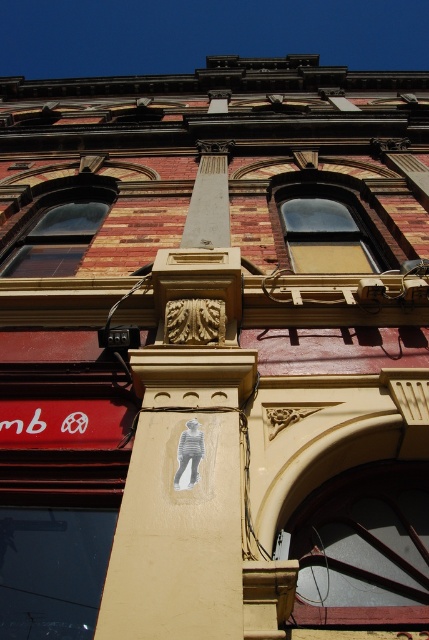
Question: Does clear glass window at center have a smaller size compared to smooth concrete column at center?

Choices:
 (A) yes
 (B) no

Answer: (B)

Question: Which point appears farthest from the camera in this image?

Choices:
 (A) (353, 252)
 (B) (30, 541)

Answer: (A)

Question: Is transparent glass window at lower left further to the viewer compared to clear glass window at upper left?

Choices:
 (A) no
 (B) yes

Answer: (A)

Question: Which point is farther to the camera?

Choices:
 (A) (69, 221)
 (B) (283, 228)

Answer: (A)

Question: Is clear glass window at center thinner than smooth concrete column at center?

Choices:
 (A) no
 (B) yes

Answer: (A)

Question: Which point is farther to the camera?

Choices:
 (A) smooth concrete column at center
 (B) transparent glass window at center

Answer: (A)